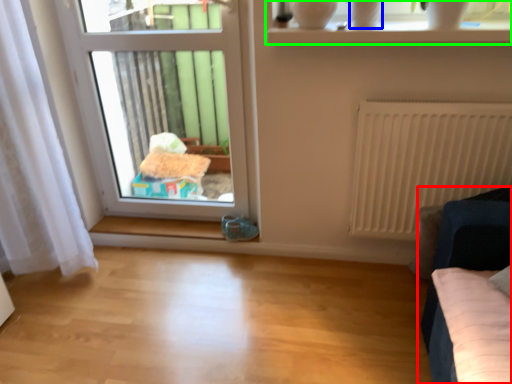
Question: Which object is positioned farthest from furniture (highlighted by a red box)? Select from glass vase (highlighted by a blue box) and window (highlighted by a green box).

Choices:
 (A) glass vase
 (B) window

Answer: (A)